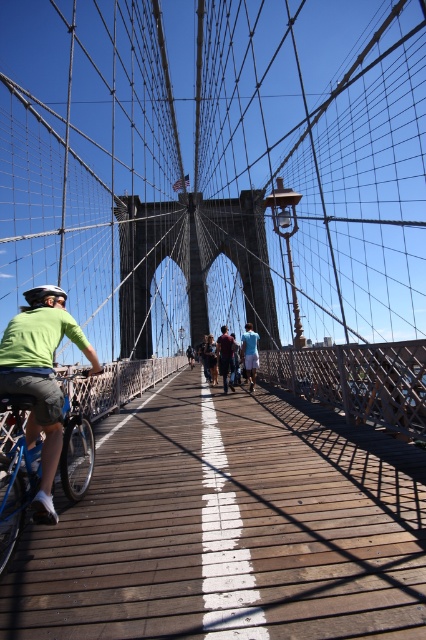
You are a pedestrian standing on the Brooklyn Bridge walkway. You see a blue metallic bicycle at left and a blue fabric shirt at center. Which object is closer to you?

The blue metallic bicycle at left is closer to you because it is positioned under the blue fabric shirt at center, indicating it is in a lower or nearer position.